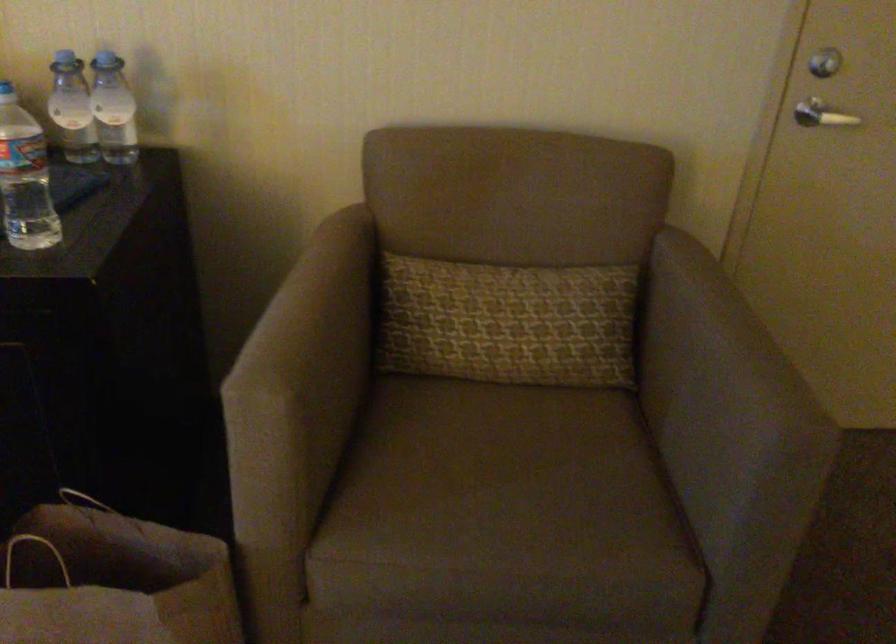
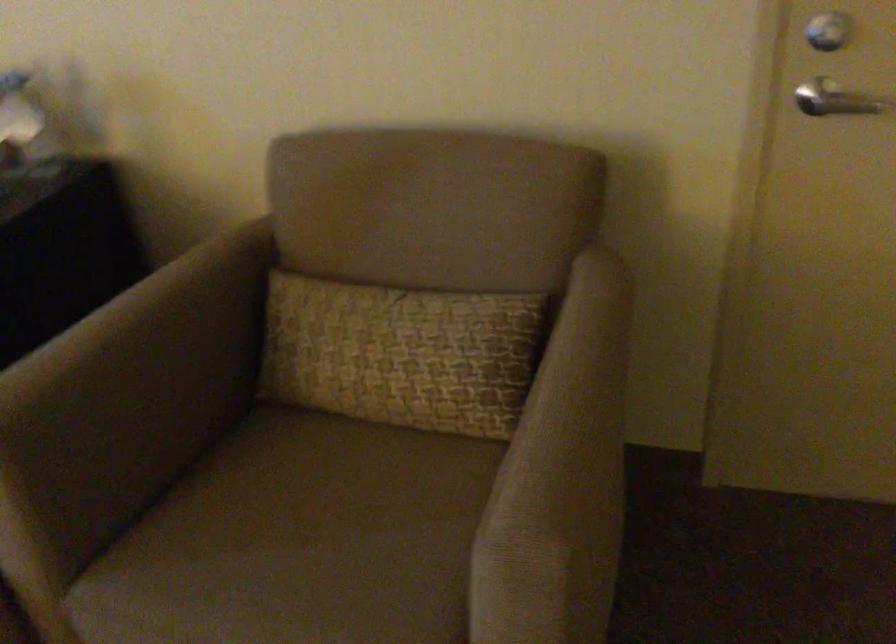
The point at [530,319] is marked in the first image. Where is the corresponding point in the second image?

(401, 353)